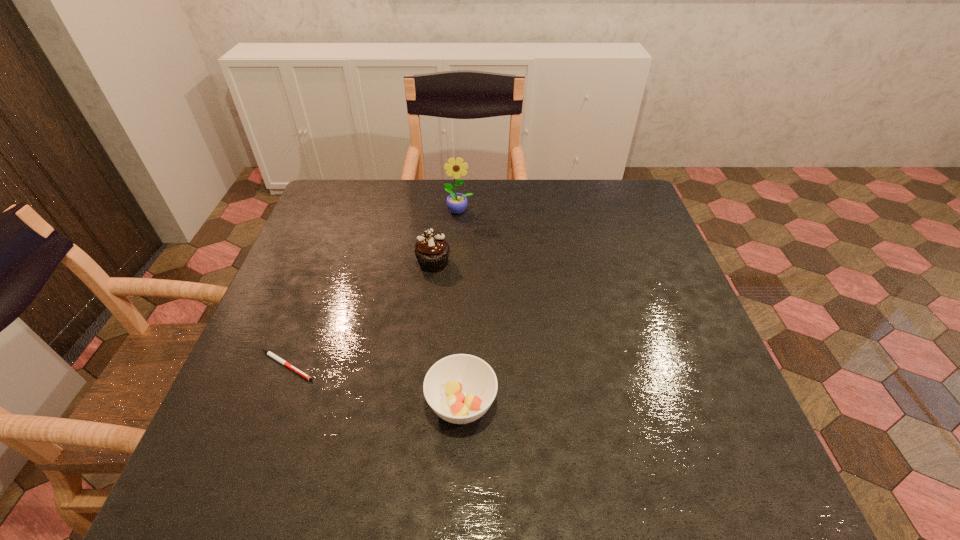
Find the location of `the second closest object to the shortest object`. the second closest object to the shortest object is located at coordinates (432, 251).

Point out which object is positioned as the third nearest to the farthest object. Please provide its 2D coordinates. Your answer should be formatted as a tuple, i.e. [(x, y)], where the tuple contains the x and y coordinates of a point satisfying the conditions above.

[(460, 388)]

Locate an element on the screen. This screenshot has height=540, width=960. vacant space that satisfies the following two spatial constraints: 1. on the front-facing side of the sunflower; 2. on the left side of the second shortest object is located at coordinates (448, 403).

The width and height of the screenshot is (960, 540). I want to click on vacant area in the image that satisfies the following two spatial constraints: 1. on the back side of the soup bowl; 2. on the clicker of the pen, so click(463, 366).

You are a GUI agent. You are given a task and a screenshot of the screen. Output one action in this format:
    pyautogui.click(x=<x>, y=<y>)
    Task: Click on the vacant space that satisfies the following two spatial constraints: 1. on the front-facing side of the sunflower; 2. on the left side of the second shortest object
    
    Given the screenshot: What is the action you would take?
    pyautogui.click(x=448, y=403)

Where is `free space that satisfies the following two spatial constraints: 1. on the front side of the third shortest object; 2. on the clicker of the leftmost object`? The width and height of the screenshot is (960, 540). free space that satisfies the following two spatial constraints: 1. on the front side of the third shortest object; 2. on the clicker of the leftmost object is located at coordinates (422, 366).

Locate an element on the screen. This screenshot has width=960, height=540. free location that satisfies the following two spatial constraints: 1. on the front-facing side of the sunflower; 2. on the clicker of the pen is located at coordinates (450, 366).

Find the location of `vacant space that satisfies the following two spatial constraints: 1. on the front-facing side of the farthest object; 2. on the right side of the soup bowl`. vacant space that satisfies the following two spatial constraints: 1. on the front-facing side of the farthest object; 2. on the right side of the soup bowl is located at coordinates (448, 403).

Where is `blank space that satisfies the following two spatial constraints: 1. on the front-facing side of the tallest object; 2. on the clicker of the shortest object`? This screenshot has width=960, height=540. blank space that satisfies the following two spatial constraints: 1. on the front-facing side of the tallest object; 2. on the clicker of the shortest object is located at coordinates (450, 366).

The image size is (960, 540). I want to click on vacant space that satisfies the following two spatial constraints: 1. on the front-facing side of the farthest object; 2. on the clicker of the shortest object, so click(x=450, y=366).